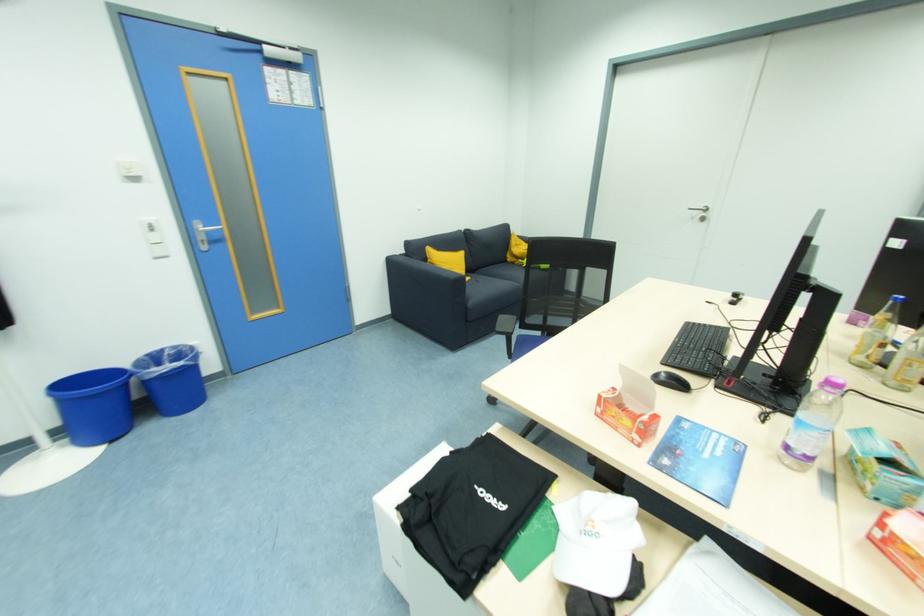
The image size is (924, 616). I want to click on chair seat, so click(554, 326).